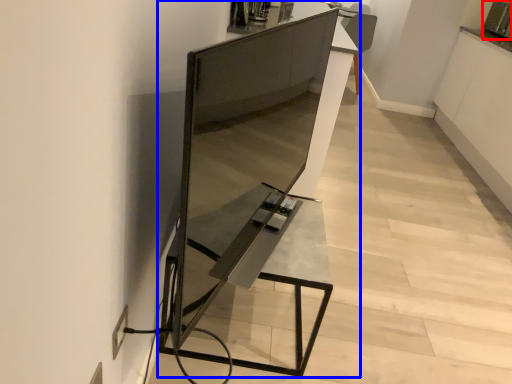
Question: Which object is further to the camera taking this photo, appliance (highlighted by a red box) or furniture (highlighted by a blue box)?

Choices:
 (A) appliance
 (B) furniture

Answer: (A)